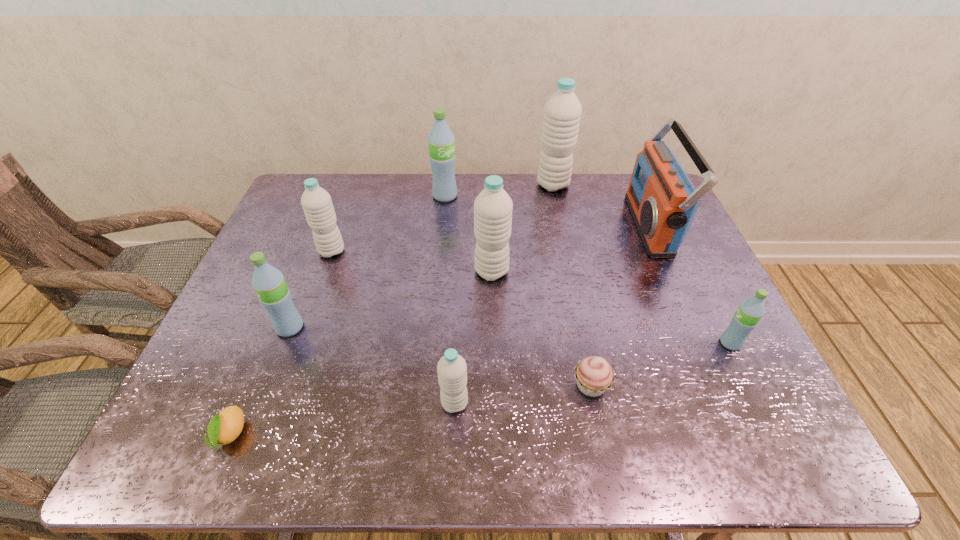
The height and width of the screenshot is (540, 960). Identify the location of the tallest water bottle. (562, 112).

At what (x,y) coordinates should I click in order to perform the action: click on the second water bottle from right to left. Please return your answer as a coordinate pair (x, y). The image size is (960, 540). Looking at the image, I should click on (562, 112).

You are a GUI agent. You are given a task and a screenshot of the screen. Output one action in this format:
    pyautogui.click(x=<x>, y=<y>)
    Task: Click on the second green water bottle from left to right
    The height and width of the screenshot is (540, 960).
    Given the screenshot: What is the action you would take?
    coord(441,141)

Identify the location of the biggest green water bottle. (441, 141).

Locate an element on the screen. the third white water bottle from left to right is located at coordinates (493, 207).

Locate an element on the screen. The width and height of the screenshot is (960, 540). the second biggest white water bottle is located at coordinates pyautogui.click(x=493, y=207).

Where is `radio receiver`? radio receiver is located at coordinates (662, 200).

Locate an element on the screen. The image size is (960, 540). the third biggest white water bottle is located at coordinates (316, 202).

Find the location of a particular element. The width and height of the screenshot is (960, 540). the second smallest green water bottle is located at coordinates (274, 294).

This screenshot has height=540, width=960. What are the coordinates of `the rightmost water bottle` in the screenshot? It's located at (745, 319).